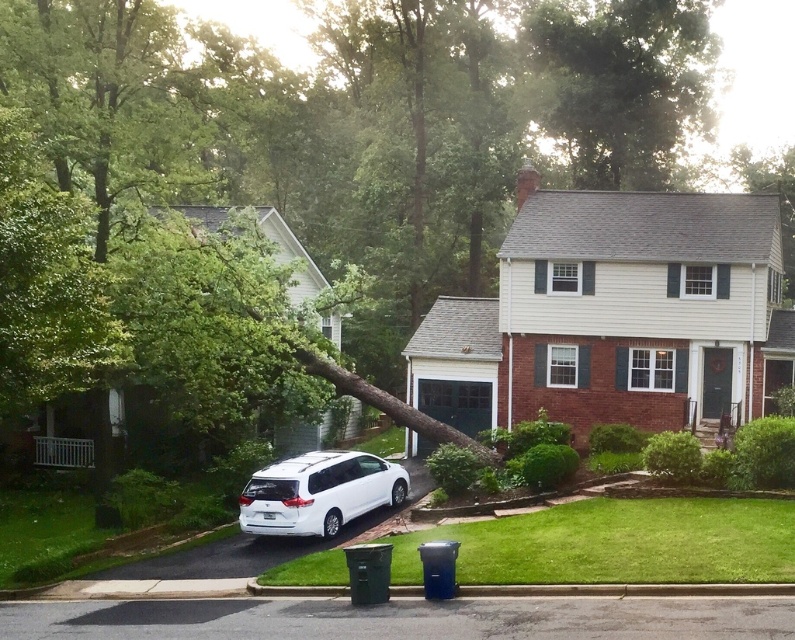
Is green leafy tree at upper center wider than white matte van at lower left?

Indeed, green leafy tree at upper center has a greater width compared to white matte van at lower left.

Between point (615, 112) and point (289, 518), which one is positioned in front?

Point (289, 518) is in front.

Locate an element on the screen. green leafy tree at upper center is located at coordinates (623, 83).